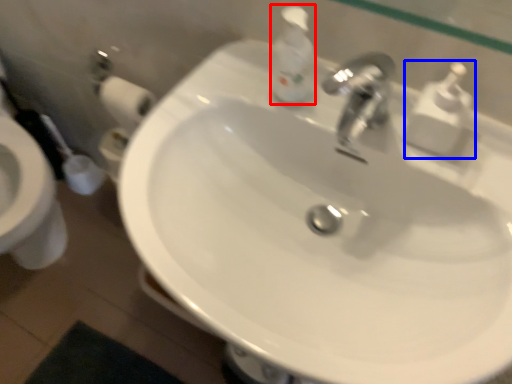
Question: Which object is further to the camera taking this photo, soap dispenser (highlighted by a red box) or soap dispenser (highlighted by a blue box)?

Choices:
 (A) soap dispenser
 (B) soap dispenser

Answer: (A)